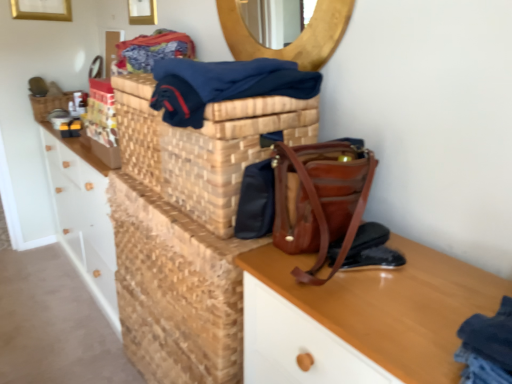
Question: Considering the positions of point (52, 100) and point (148, 19), is point (52, 100) closer or farther from the camera than point (148, 19)?

Choices:
 (A) farther
 (B) closer

Answer: (A)

Question: Choose the correct answer: Is wooden woven basket at upper left inside wooden picture frame at upper center, which ranks as the 1th picture frame in right-to-left order, or outside it?

Choices:
 (A) inside
 (B) outside

Answer: (B)

Question: Estimate the real-world distances between objects in this image. Which object is closer to the brown leather handbag at center?

Choices:
 (A) wooden picture frame at upper center, the 2th picture frame positioned from the back
 (B) leather at center, the 1th shoe in the top-to-bottom sequence
 (C) dark blue fabric at upper center
 (D) gold metallic picture frame at upper left, which appears as the 1th picture frame when viewed from the left
 (E) wooden desk at lower right

Answer: (B)

Question: Estimate the real-world distances between objects in this image. Which object is farther from the woven brown basket at center?

Choices:
 (A) wooden desk at lower right
 (B) dark blue fabric at upper center
 (C) gold metallic picture frame at upper left, which appears as the 1th picture frame when viewed from the back
 (D) wooden mirror at upper center
 (E) brown leather handbag at center

Answer: (C)